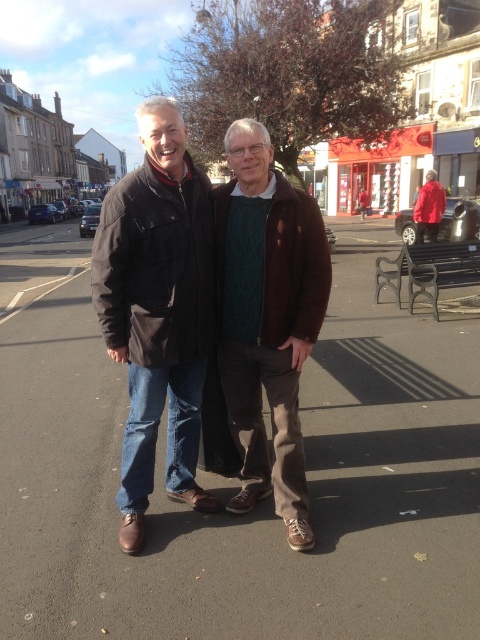
You are a fashion designer observing two jackets in an outdoor photo. You need to determine which jacket appears larger in size based on their height. The jackets are the dark brown leather jacket at center and the brown suede jacket at center. Which one is taller?

The dark brown leather jacket at center is much taller than the brown suede jacket at center according to the description.